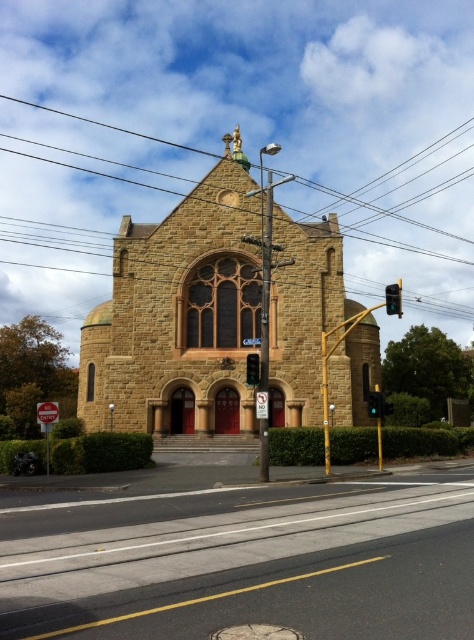
Between point (107, 618) and point (49, 408), which one is positioned in front?

Positioned in front is point (107, 618).

Is asphalt road at lower center taller than red plastic stop sign at center?

Incorrect, asphalt road at lower center's height is not larger of red plastic stop sign at center's.

From the picture: Measure the distance between asphalt road at lower center and camera.

A distance of 93.77 feet exists between asphalt road at lower center and camera.

At what (x,y) coordinates should I click in order to perform the action: click on asphalt road at lower center. Please return your answer as a coordinate pair (x, y). Looking at the image, I should click on (242, 557).

Can you confirm if black plastic traffic light at center right is positioned above red plastic stop sign at center?

Yes.

Measure the distance between black plastic traffic light at center right and camera.

They are 62.28 meters apart.

Locate an element on the screen. The height and width of the screenshot is (640, 474). black plastic traffic light at center right is located at coordinates (393, 298).

Can you confirm if black wire at upper center is positioned to the right of black plastic traffic light at center right?

No, black wire at upper center is not to the right of black plastic traffic light at center right.

Who is higher up, black wire at upper center or black plastic traffic light at center right?

black wire at upper center is higher up.

Is point (473, 316) less distant than point (394, 285)?

No, it is not.

You are a GUI agent. You are given a task and a screenshot of the screen. Output one action in this format:
    pyautogui.click(x=<x>, y=<y>)
    Task: Click on the black wire at upper center
    
    Given the screenshot: What is the action you would take?
    pyautogui.click(x=376, y=209)